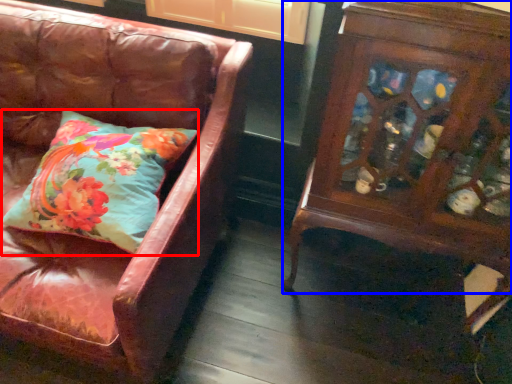
Question: Among these objects, which one is nearest to the camera, pillow (highlighted by a red box) or furniture (highlighted by a blue box)?

Choices:
 (A) pillow
 (B) furniture

Answer: (B)